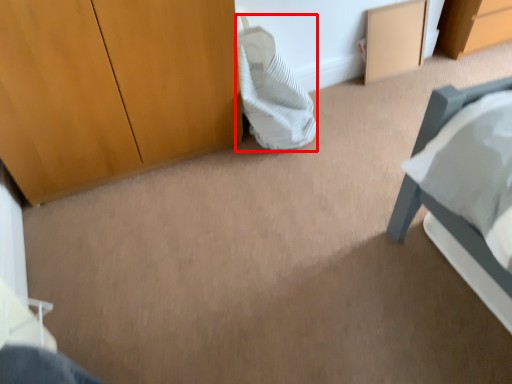
Question: Considering the relative positions of pillow (annotated by the red box) and cabinetry in the image provided, where is pillow (annotated by the red box) located with respect to the staircase?

Choices:
 (A) left
 (B) right

Answer: (A)